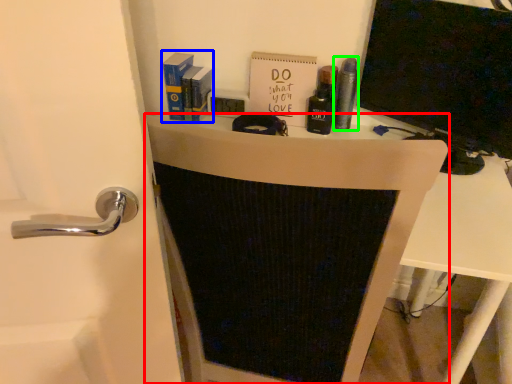
Question: Estimate the real-world distances between objects in this image. Which object is closer to furniture (highlighted by a red box), book (highlighted by a blue box) or toiletry (highlighted by a green box)?

Choices:
 (A) book
 (B) toiletry

Answer: (B)